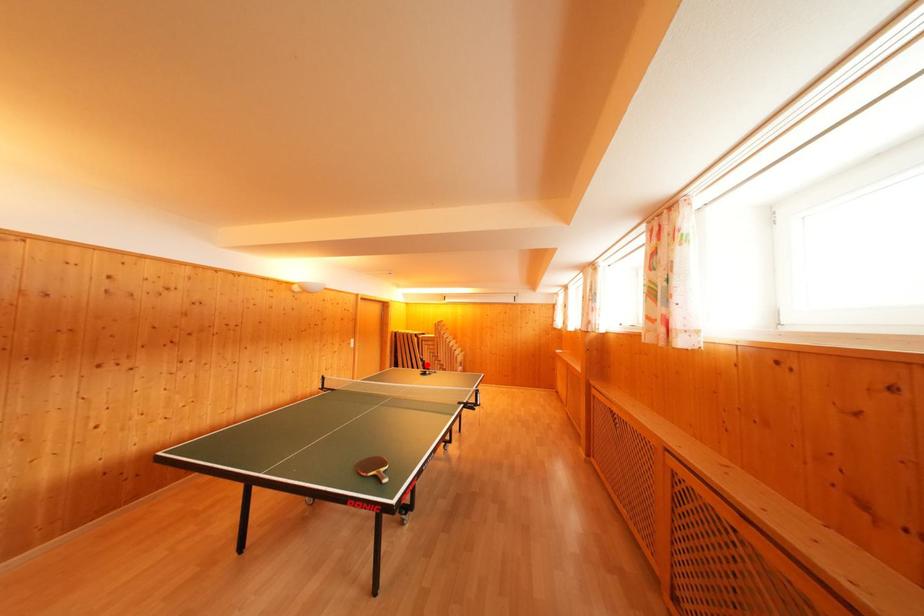
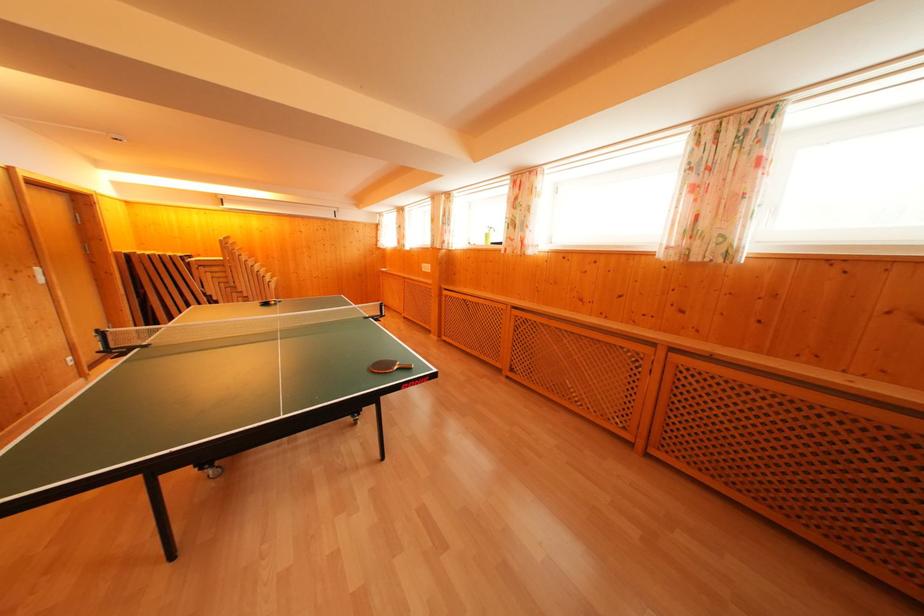
Find the pixel in the second image that matches the highlighted location in the first image.

(210, 300)